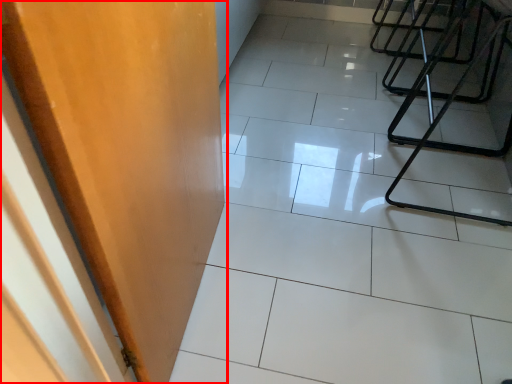
Question: From the image's perspective, where is door (annotated by the red box) located relative to ceramic tile?

Choices:
 (A) below
 (B) above

Answer: (A)